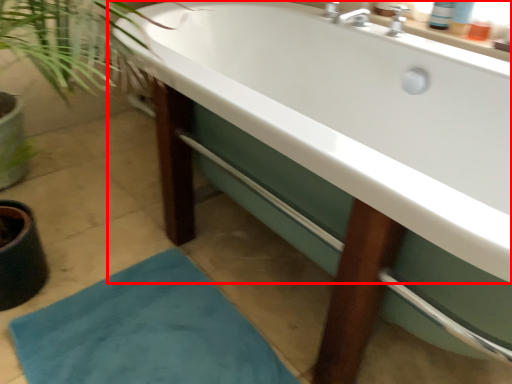
Question: From the image's perspective, where is bathtub (annotated by the red box) located relative to bath mat?

Choices:
 (A) below
 (B) above

Answer: (B)